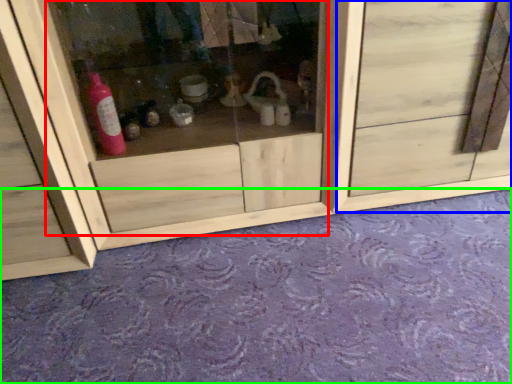
Question: Considering the real-world distances, which object is closest to glass door (highlighted by a red box)? door (highlighted by a blue box) or plain (highlighted by a green box).

Choices:
 (A) door
 (B) plain

Answer: (A)